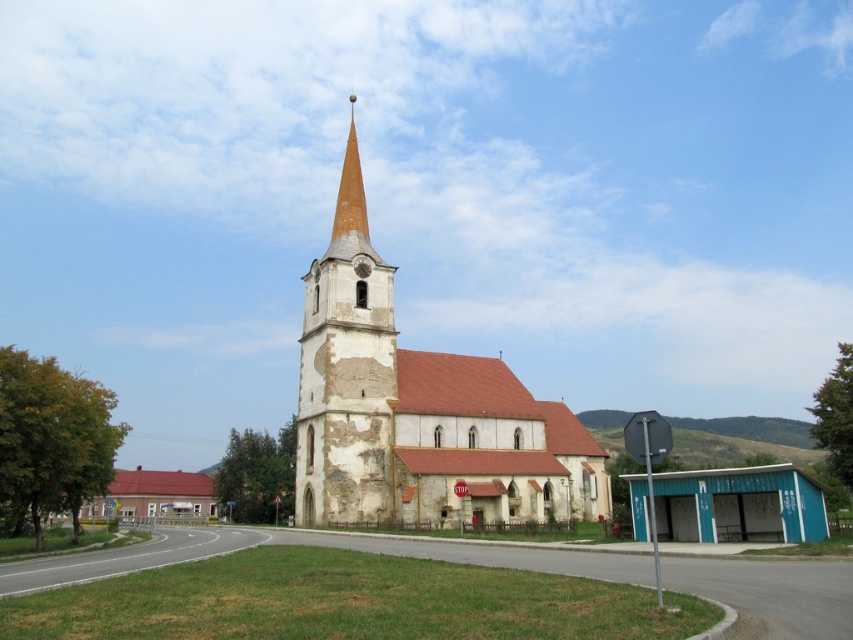
Which is below, white stone church at center or yellowish stone steeple at center?

white stone church at center

Is white stone church at center shorter than yellowish stone steeple at center?

No, white stone church at center is not shorter than yellowish stone steeple at center.

Does point (323, 508) come behind point (370, 508)?

No, it is not.

The width and height of the screenshot is (853, 640). I want to click on white stone church at center, so click(x=418, y=408).